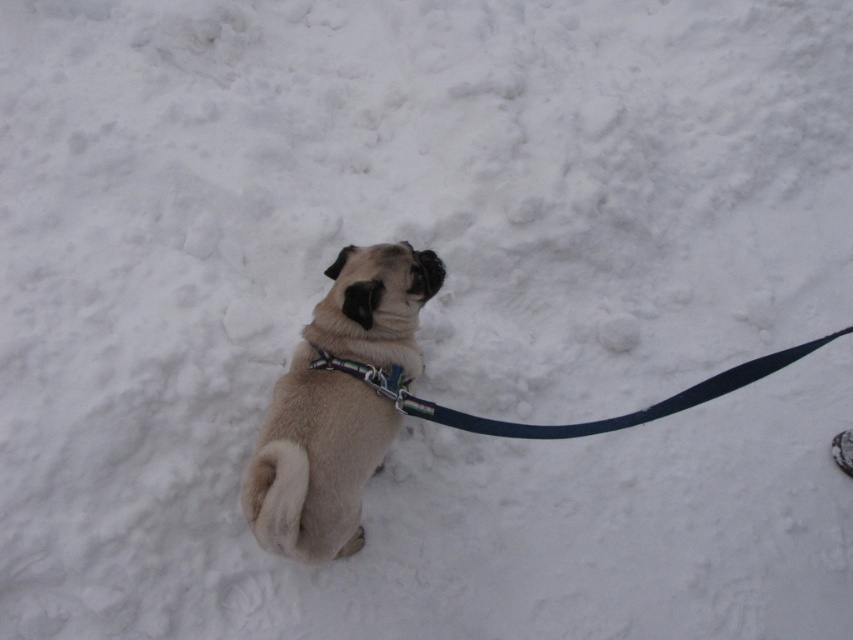
Question: Does beige fur dog at center appear on the left side of metallic chain at center?

Choices:
 (A) yes
 (B) no

Answer: (A)

Question: Based on their relative distances, which object is farther from the black nylon leash at center?

Choices:
 (A) beige fur dog at center
 (B) metallic chain at center

Answer: (A)

Question: Considering the real-world distances, which object is farthest from the metallic chain at center?

Choices:
 (A) black nylon leash at center
 (B) beige fur dog at center

Answer: (A)

Question: Which point is farther from the camera taking this photo?

Choices:
 (A) (322, 468)
 (B) (332, 364)

Answer: (B)

Question: Can you confirm if black nylon leash at center is positioned to the right of metallic chain at center?

Choices:
 (A) no
 (B) yes

Answer: (B)

Question: Does black nylon leash at center appear on the left side of metallic chain at center?

Choices:
 (A) yes
 (B) no

Answer: (B)